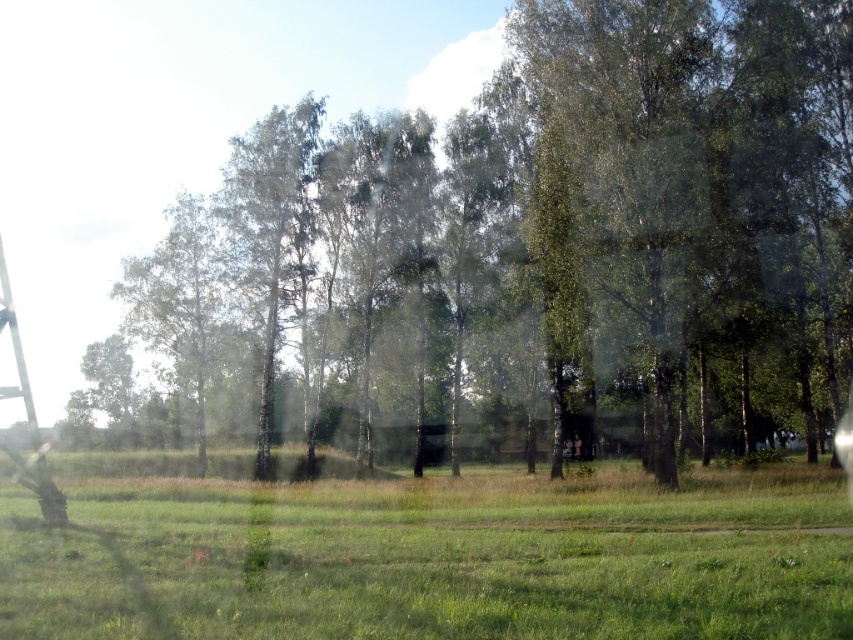
Question: Does green leafy tree at center appear on the right side of green grass at center?

Choices:
 (A) yes
 (B) no

Answer: (A)

Question: Which of the following is the closest to the observer?

Choices:
 (A) metallic silver ladder at left
 (B) green leafy tree at center
 (C) green grass at center

Answer: (C)

Question: Which point is closer to the camera?

Choices:
 (A) green leafy tree at center
 (B) green grass at center
 (C) metallic silver ladder at left

Answer: (B)

Question: Is green leafy tree at center smaller than metallic silver ladder at left?

Choices:
 (A) yes
 (B) no

Answer: (A)

Question: Where is green grass at center located in relation to metallic silver ladder at left in the image?

Choices:
 (A) left
 (B) right

Answer: (B)

Question: Which point is farther to the camera?

Choices:
 (A) green grass at center
 (B) green leafy tree at center
 (C) metallic silver ladder at left

Answer: (B)